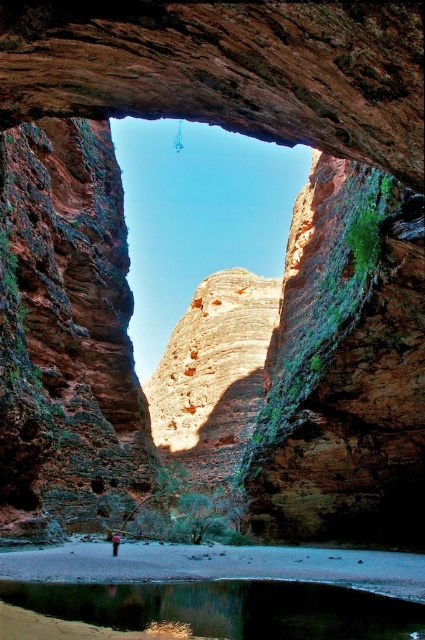
Is green reflective water at lower center above pink fabric person at center?

Indeed, green reflective water at lower center is positioned over pink fabric person at center.

I want to click on green reflective water at lower center, so click(226, 608).

Between point (306, 593) and point (115, 540), which one is positioned in front?

Point (306, 593)

Where is `green reflective water at lower center`? The image size is (425, 640). green reflective water at lower center is located at coordinates (226, 608).